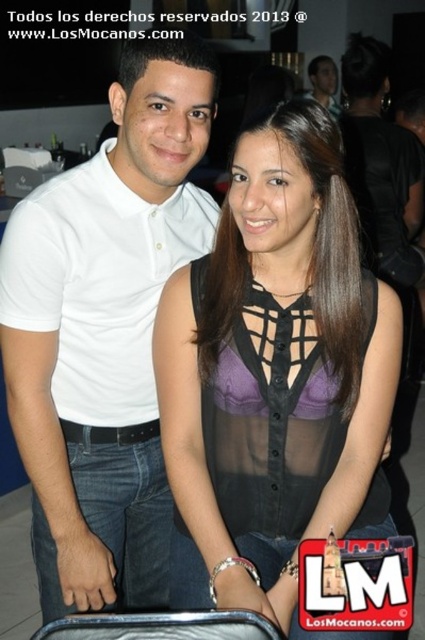
You are a photographer adjusting your camera to focus on the sheer black blouse at center and the white cotton polo shirt at center. Which of these two items is positioned closer to the camera?

The sheer black blouse at center is closer to the viewer than the white cotton polo shirt at center, so the sheer black blouse at center is positioned closer to the camera.

You are organizing a charity event and need to display two shirts on a mannequin. The white cotton polo shirt at center and the matte black shirt at upper center are available. If you want to showcase the larger shirt first, which one should you place on the left side of the display?

The white cotton polo shirt at center has a larger width than the matte black shirt at upper center, so you should place the white cotton polo shirt at center on the left side of the display to showcase the larger one first.